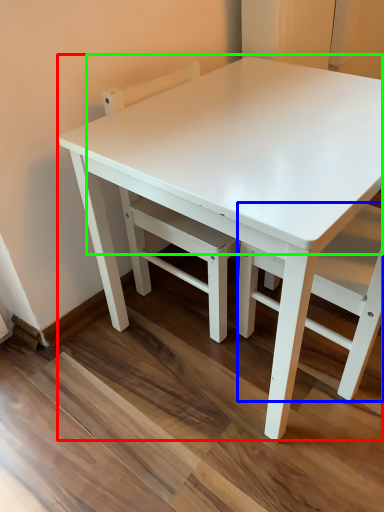
Question: Considering the real-world distances, which object is closest to table (highlighted by a red box)? chair (highlighted by a blue box) or table top (highlighted by a green box).

Choices:
 (A) chair
 (B) table top

Answer: (B)